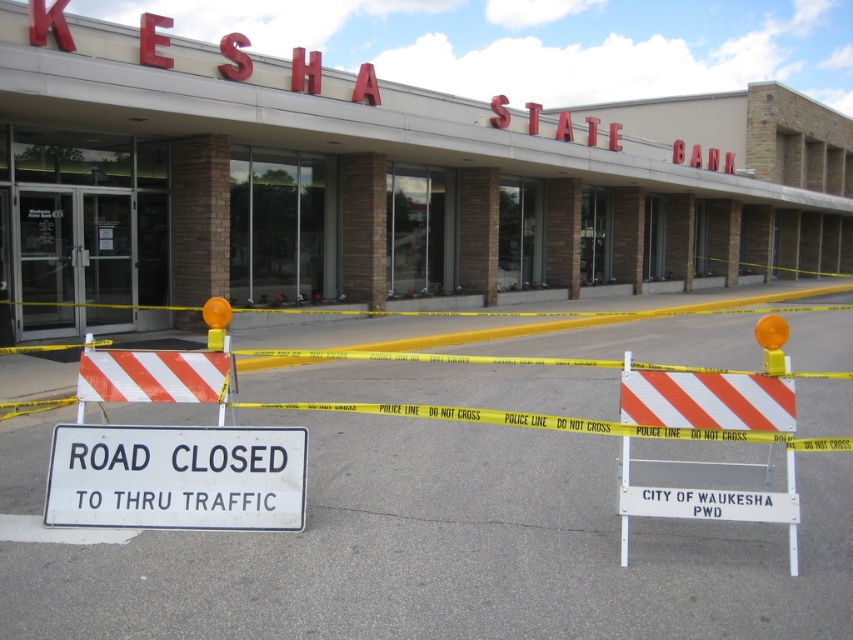
You are a delivery person trying to access the bank entrance. You see the brick wall at center and the white plastic barricade at center. Which object is wider from your perspective?

The brick wall at center is wider than the white plastic barricade at center.

You are a delivery person approaching the KESHA STATE BANK. You see a brick wall at center and a white plastic barricade at center. Which object is bigger in size?

The brick wall at center has a larger size compared to the white plastic barricade at center.